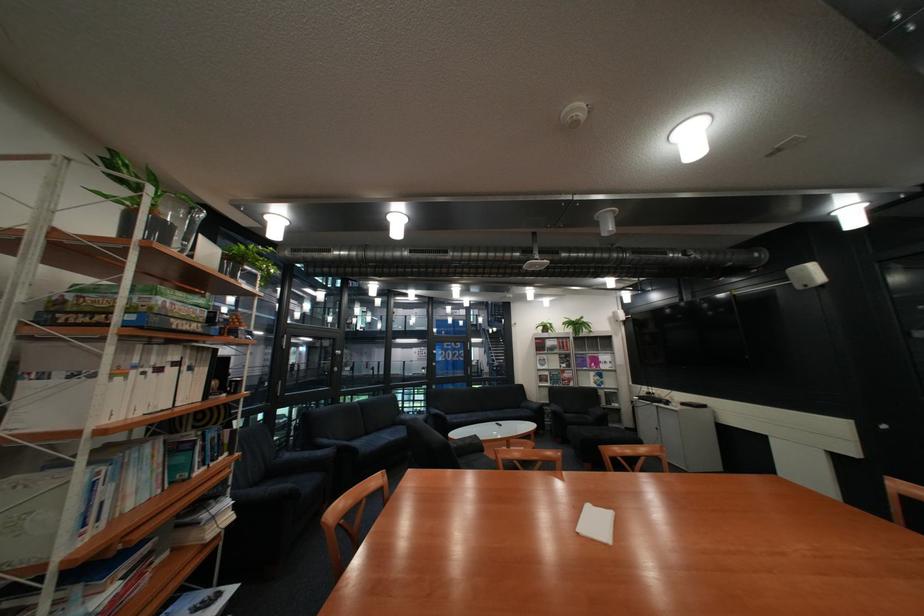
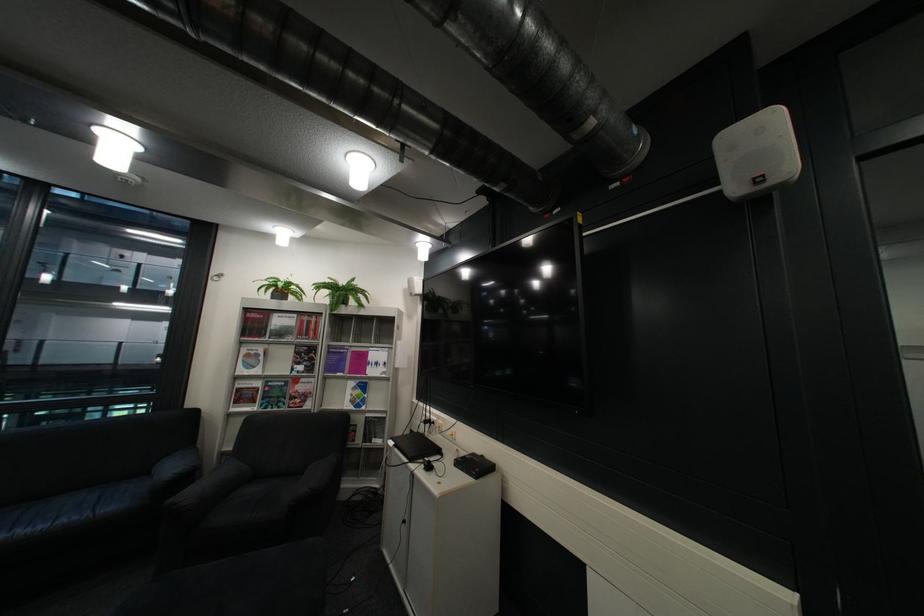
Find the pixel in the second image that matches the point at 631,321 in the first image.

(427, 294)